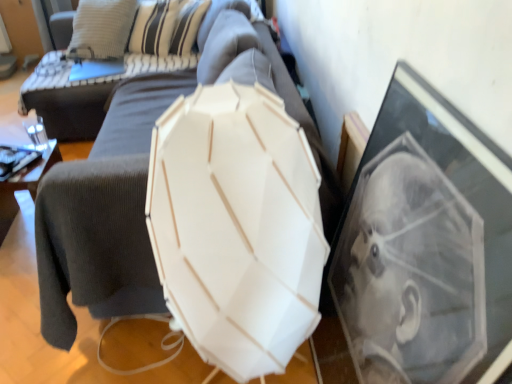
Question: From the image's perspective, is dark gray fabric couch at center above dark gray corduroy armchair at left?

Choices:
 (A) yes
 (B) no

Answer: (A)

Question: Is dark gray fabric couch at center looking in the opposite direction of dark gray corduroy armchair at left?

Choices:
 (A) yes
 (B) no

Answer: (B)

Question: Could you tell me if dark gray fabric couch at center is turned towards dark gray corduroy armchair at left?

Choices:
 (A) yes
 (B) no

Answer: (A)

Question: Is dark gray fabric couch at center positioned before dark gray corduroy armchair at left?

Choices:
 (A) no
 (B) yes

Answer: (A)

Question: Is dark gray fabric couch at center next to dark gray corduroy armchair at left and touching it?

Choices:
 (A) yes
 (B) no

Answer: (B)

Question: Is dark gray fabric couch at center located outside dark gray corduroy armchair at left?

Choices:
 (A) yes
 (B) no

Answer: (A)

Question: Considering the relative positions of dark gray corduroy armchair at left and white matte umbrella at center in the image provided, is dark gray corduroy armchair at left to the left of white matte umbrella at center from the viewer's perspective?

Choices:
 (A) yes
 (B) no

Answer: (A)

Question: Is the surface of dark gray corduroy armchair at left in direct contact with white matte umbrella at center?

Choices:
 (A) no
 (B) yes

Answer: (A)

Question: Does dark gray corduroy armchair at left have a smaller size compared to white matte umbrella at center?

Choices:
 (A) yes
 (B) no

Answer: (A)

Question: Considering the relative positions of dark gray corduroy armchair at left and white matte umbrella at center in the image provided, is dark gray corduroy armchair at left behind white matte umbrella at center?

Choices:
 (A) yes
 (B) no

Answer: (A)

Question: From a real-world perspective, is dark gray corduroy armchair at left on top of white matte umbrella at center?

Choices:
 (A) yes
 (B) no

Answer: (B)

Question: From the image's perspective, is dark gray corduroy armchair at left above white matte umbrella at center?

Choices:
 (A) yes
 (B) no

Answer: (A)

Question: Is white matte lampshade at center touching white matte umbrella at center?

Choices:
 (A) no
 (B) yes

Answer: (A)